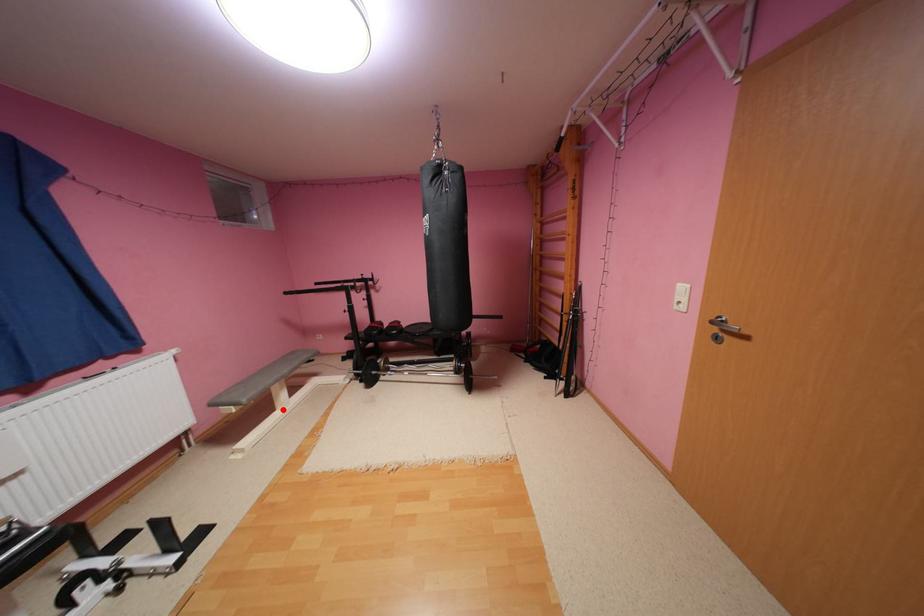
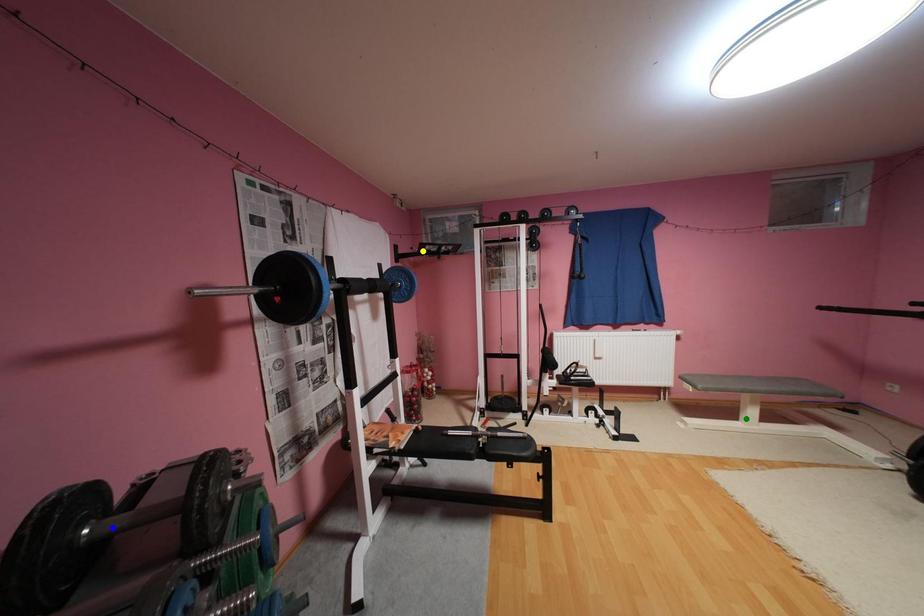
Question: I am providing you with two images of the same scene from different viewpoints. A red point is marked on the first image. You are given multiple points on the second image. Which point in image 2 represents the same 3d spot as the red point in image 1?

Choices:
 (A) yellow point
 (B) green point
 (C) blue point

Answer: (B)